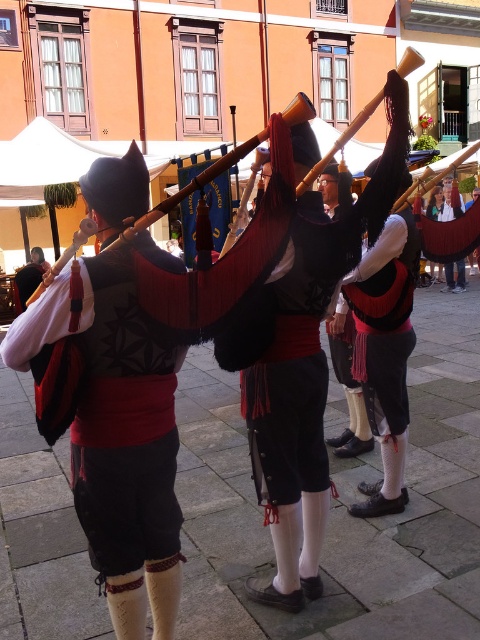
Question: Which of the following is the closest to the observer?

Choices:
 (A) click(369, 483)
 (B) click(148, 220)

Answer: (B)

Question: Does matte black vest at center have a larger size compared to matte red bagpipe at center?

Choices:
 (A) no
 (B) yes

Answer: (A)

Question: Observing the image, what is the correct spatial positioning of matte black vest at center in reference to matte red bagpipe at center?

Choices:
 (A) below
 (B) above

Answer: (A)

Question: Which point is closer to the camera taking this photo?

Choices:
 (A) (363, 486)
 (B) (238, 154)

Answer: (B)

Question: Does matte black vest at center appear under matte red bagpipe at center?

Choices:
 (A) no
 (B) yes

Answer: (B)

Question: Which object is closer to the camera taking this photo?

Choices:
 (A) matte black vest at center
 (B) matte red bagpipe at center

Answer: (B)